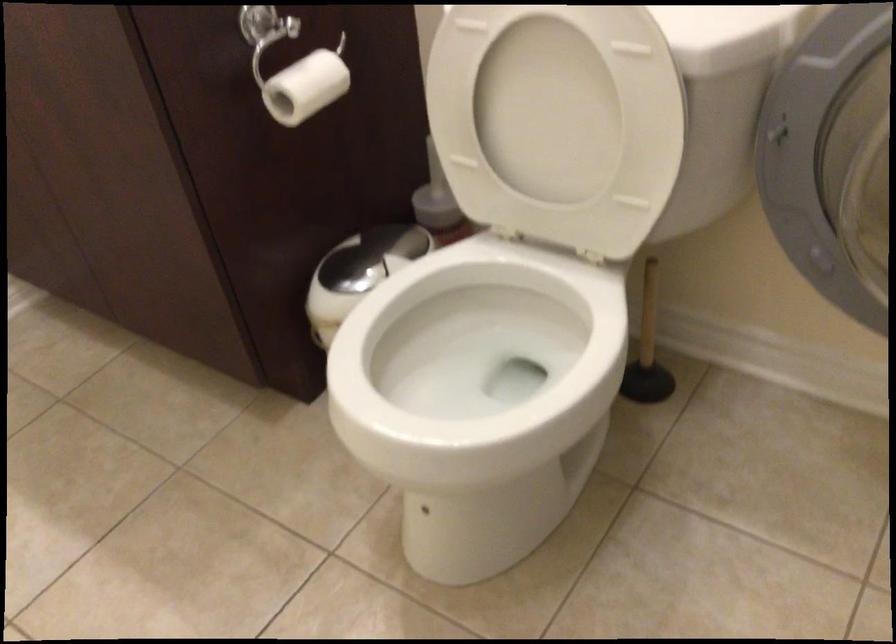
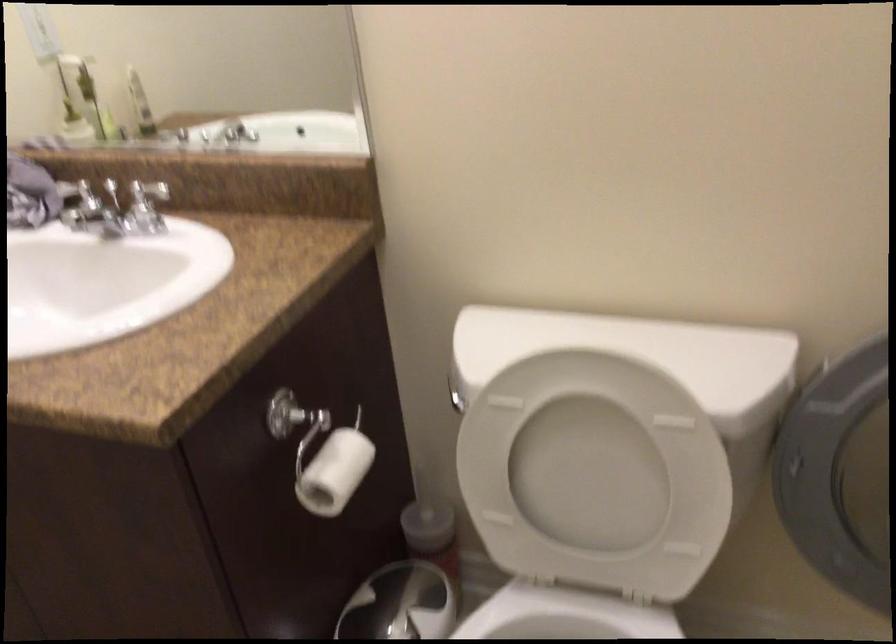
Where in the second image is the point corresponding to point (297, 84) from the first image?

(334, 471)